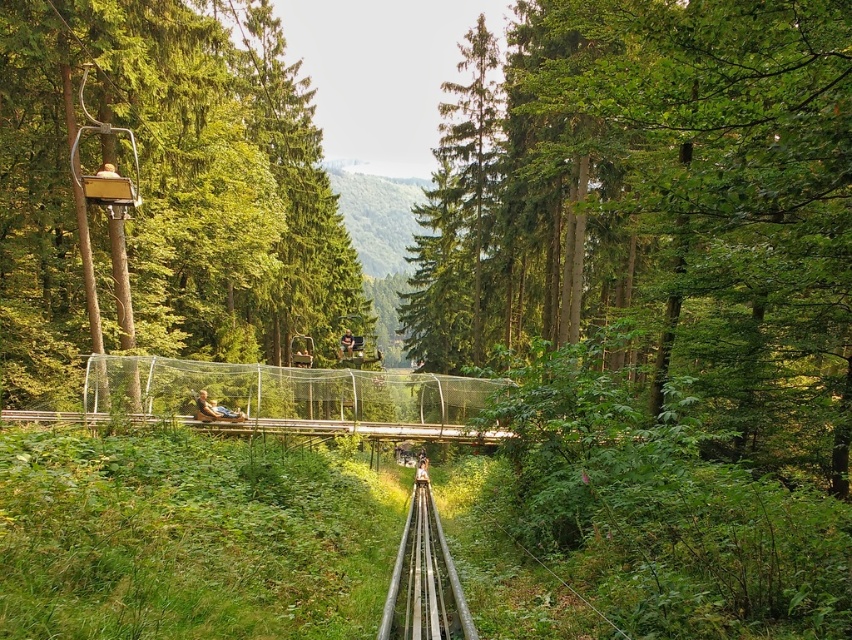
How distant is green leafy tree at center from matte black person at center?

The distance of green leafy tree at center from matte black person at center is 18.30 meters.

Between green leafy tree at center and matte black person at center, which one is positioned higher?

green leafy tree at center is above.

Is point (751, 445) closer to viewer compared to point (202, 410)?

Yes, it is.

Where is `green leafy tree at center`? The width and height of the screenshot is (852, 640). green leafy tree at center is located at coordinates (661, 212).

Is green leafy tree at center to the left of green matte tree at left from the viewer's perspective?

No, green leafy tree at center is not to the left of green matte tree at left.

In order to click on green leafy tree at center in this screenshot , I will do (x=661, y=212).

Does green matte tree at left have a greater height compared to matte black person at center?

Indeed, green matte tree at left has a greater height compared to matte black person at center.

This screenshot has width=852, height=640. Identify the location of green matte tree at left. (164, 193).